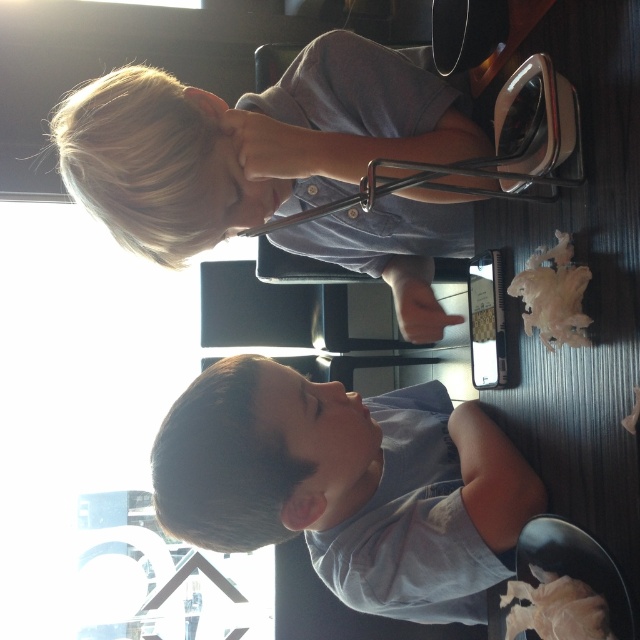
You are a photographer taking a picture of the light brown hair at upper left and the gray cotton shirt at lower center. The minimum distance between the two objects in the scene is 8.44 inches. If your camera has a depth of field that can sharply focus on objects within a 7 inch range, will both objects be in focus in the photo?

The light brown hair at upper left and the gray cotton shirt at lower center are 8.44 inches apart, which exceeds the camera depth of field range of 7 inches. Therefore, both objects cannot be in focus simultaneously in the photo.

You are a photographer standing at the center of the room. You want to take a photo of the point at coordinates (348, 484). Which object in the scene is this point located on?

The point at coordinates (348, 484) is located on the gray cotton shirt at lower center.